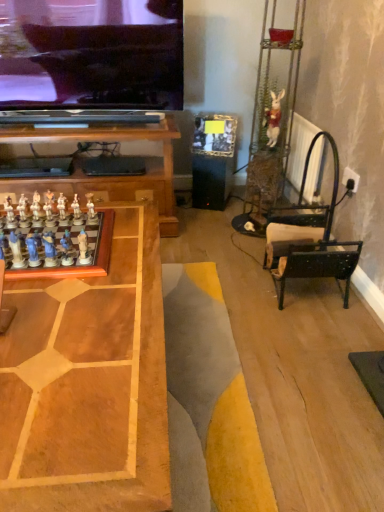
Find the location of a particular element. Image resolution: width=384 pixels, height=512 pixels. free space in front of matte blue chess pieces at left, marked as the eleventh toy in a back-to-front arrangement is located at coordinates (22, 293).